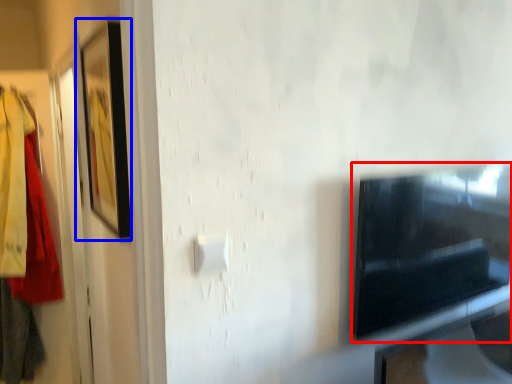
Question: Which object appears closest to the camera in this image, appliance (highlighted by a red box) or picture frame (highlighted by a blue box)?

Choices:
 (A) appliance
 (B) picture frame

Answer: (B)